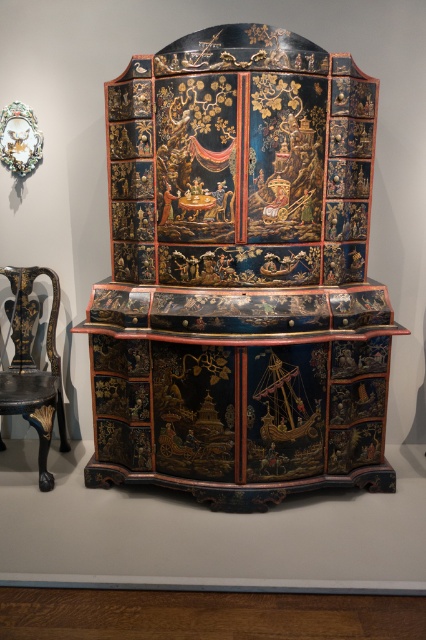
You are standing in front of a room with the glossy lacquered cabinet at center. If you want to place a small vase on the floor directly in front of the cabinet, where should you position it relative to the cabinet?

The glossy lacquered cabinet at center is located at point (x=239, y=275), so you should place the vase directly in front of it at the same x coordinate 0.430 but lower y coordinate than 0.563 to be on the floor in front.

You are a furniture designer who needs to place a 1 meter wide sofa between the glossy lacquered cabinet at center and the glossy black wood chair at left. Is there enough space for the sofa?

The glossy lacquered cabinet at center is 85.23 centimeters from the glossy black wood chair at left. Since the sofa is 1 meter wide, which is 100 centimeters, there is not enough space to place the sofa between them.